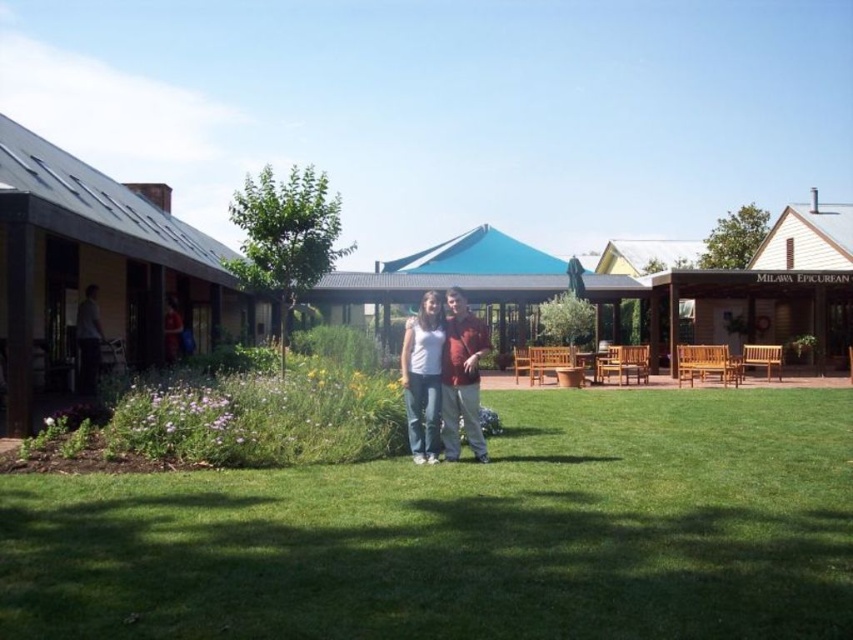
Is point (480, 355) less distant than point (83, 298)?

Yes, it is in front of point (83, 298).

Describe the element at coordinates (451, 369) in the screenshot. I see `matte white shirt at center` at that location.

Is point (466, 433) farther from viewer compared to point (79, 328)?

No, (466, 433) is closer to viewer.

The width and height of the screenshot is (853, 640). I want to click on matte white shirt at center, so click(x=451, y=369).

How much distance is there between green grass at center and matte white shirt at center?

A distance of 7.09 feet exists between green grass at center and matte white shirt at center.

Does green grass at center lie behind matte white shirt at center?

No, green grass at center is closer to the viewer.

You are a GUI agent. You are given a task and a screenshot of the screen. Output one action in this format:
    pyautogui.click(x=<x>, y=<y>)
    Task: Click on the green grass at center
    Image resolution: width=853 pixels, height=640 pixels.
    Given the screenshot: What is the action you would take?
    pyautogui.click(x=468, y=532)

Does green grass at center have a greater height compared to matte gray shirt at left?

No, green grass at center is not taller than matte gray shirt at left.

What do you see at coordinates (468, 532) in the screenshot? Image resolution: width=853 pixels, height=640 pixels. I see `green grass at center` at bounding box center [468, 532].

Between point (341, 496) and point (99, 340), which one is positioned behind?

Point (99, 340)

Find the location of `green grass at center`. green grass at center is located at coordinates (468, 532).